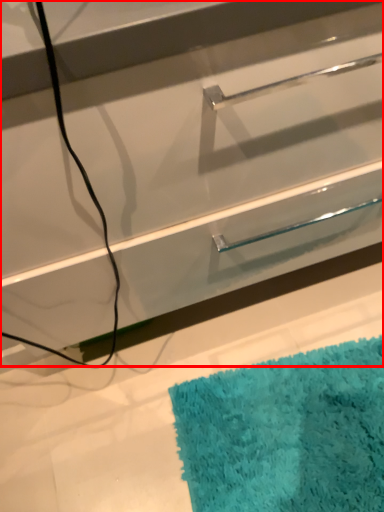
Question: From the image, what is the correct spatial relationship of drawer (annotated by the red box) in relation to bath mat?

Choices:
 (A) right
 (B) left

Answer: (B)